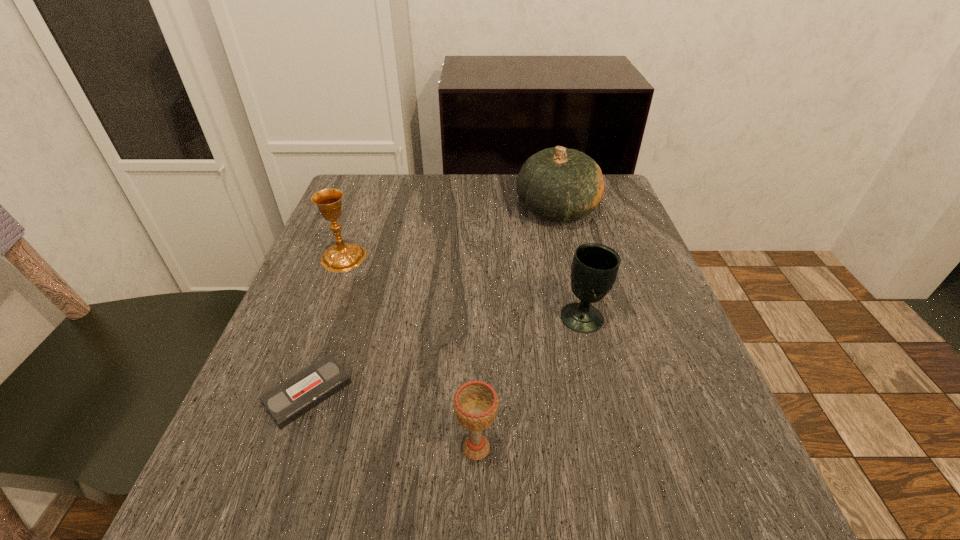
The width and height of the screenshot is (960, 540). What are the coordinates of `free point between the third object from left to right and the leftmost chalice` in the screenshot? It's located at (410, 353).

Where is `vacant space that is in between the shortest chalice and the farthest chalice`? vacant space that is in between the shortest chalice and the farthest chalice is located at coordinates (410, 353).

The height and width of the screenshot is (540, 960). I want to click on vacant area that lies between the second nearest chalice and the third object from right to left, so click(530, 383).

Where is `empty space between the farthest chalice and the fourth tallest object`? The height and width of the screenshot is (540, 960). empty space between the farthest chalice and the fourth tallest object is located at coordinates (410, 353).

Where is `vacant region between the shortest object and the nearest chalice`? vacant region between the shortest object and the nearest chalice is located at coordinates (392, 420).

Find the location of `vacant space that is in between the fourth nearest object and the farthest object`. vacant space that is in between the fourth nearest object and the farthest object is located at coordinates pyautogui.click(x=450, y=234).

Locate an element on the screen. The height and width of the screenshot is (540, 960). object that is the closest to the second farthest object is located at coordinates (286, 402).

Find the location of a particular element. The image size is (960, 540). the closest object to the fourth tallest object is located at coordinates (286, 402).

Locate an element on the screen. The height and width of the screenshot is (540, 960). chalice that stands as the second closest to the third farthest object is located at coordinates (342, 257).

The image size is (960, 540). Identify the location of chalice that is the second closest to the fourth nearest object. (475, 403).